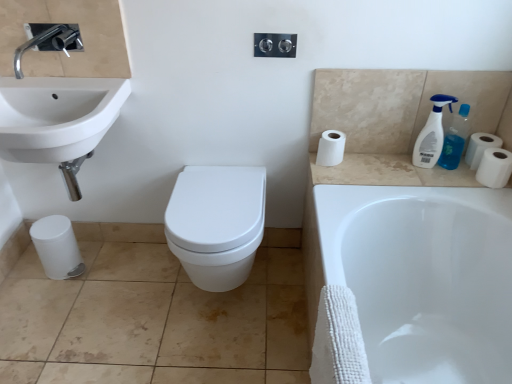
Question: Is white matte toilet paper at right, acting as the 2th toilet paper starting from the top, outside white glossy sink at upper left?

Choices:
 (A) yes
 (B) no

Answer: (A)

Question: Can you confirm if white matte toilet paper at right, acting as the 2th toilet paper starting from the top, is shorter than white glossy sink at upper left?

Choices:
 (A) no
 (B) yes

Answer: (B)

Question: Is white matte toilet paper at right, placed as the first toilet paper when sorted from right to left, to the right of white glossy sink at upper left from the viewer's perspective?

Choices:
 (A) yes
 (B) no

Answer: (A)

Question: Considering the relative sizes of white matte toilet paper at right, placed as the first toilet paper when sorted from right to left, and white glossy sink at upper left in the image provided, is white matte toilet paper at right, placed as the first toilet paper when sorted from right to left, taller than white glossy sink at upper left?

Choices:
 (A) no
 (B) yes

Answer: (A)

Question: Considering the relative sizes of white matte toilet paper at right, the fourth toilet paper positioned from the left, and white glossy sink at upper left in the image provided, is white matte toilet paper at right, the fourth toilet paper positioned from the left, thinner than white glossy sink at upper left?

Choices:
 (A) yes
 (B) no

Answer: (A)

Question: Is white matte toilet paper at right, the fourth toilet paper positioned from the left, facing away from white glossy sink at upper left?

Choices:
 (A) no
 (B) yes

Answer: (A)

Question: Can you confirm if black plastic dispenser at upper center is bigger than white glossy sink at upper left?

Choices:
 (A) yes
 (B) no

Answer: (B)

Question: Is black plastic dispenser at upper center far away from white glossy sink at upper left?

Choices:
 (A) no
 (B) yes

Answer: (A)

Question: Is black plastic dispenser at upper center smaller than white glossy sink at upper left?

Choices:
 (A) yes
 (B) no

Answer: (A)

Question: From the image's perspective, is black plastic dispenser at upper center on white glossy sink at upper left?

Choices:
 (A) yes
 (B) no

Answer: (A)

Question: Can you confirm if black plastic dispenser at upper center is shorter than white glossy sink at upper left?

Choices:
 (A) no
 (B) yes

Answer: (B)

Question: Is black plastic dispenser at upper center positioned in front of white glossy sink at upper left?

Choices:
 (A) no
 (B) yes

Answer: (A)

Question: From a real-world perspective, is black plastic dispenser at upper center positioned over white matte toilet paper at lower left, positioned as the 4th toilet paper in right-to-left order, based on gravity?

Choices:
 (A) no
 (B) yes

Answer: (B)